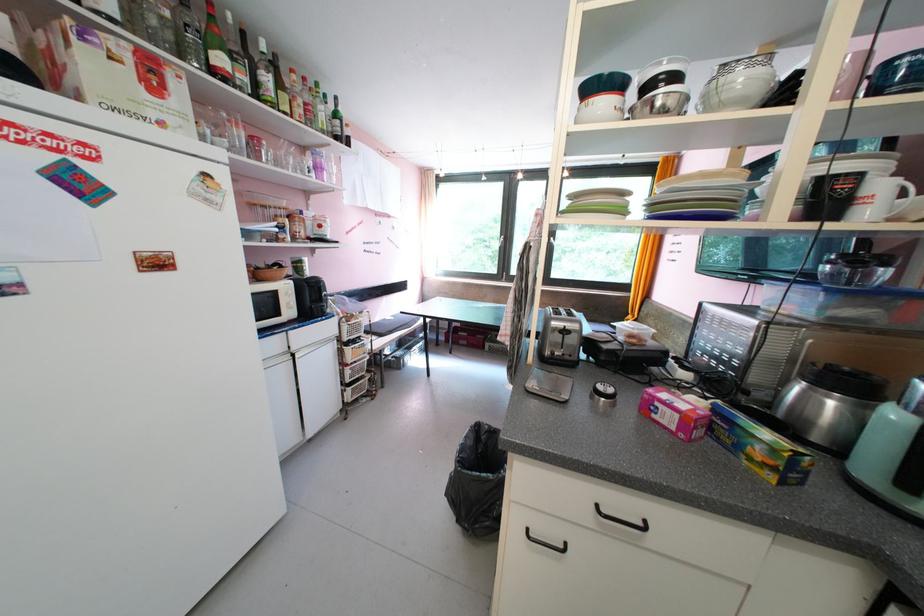
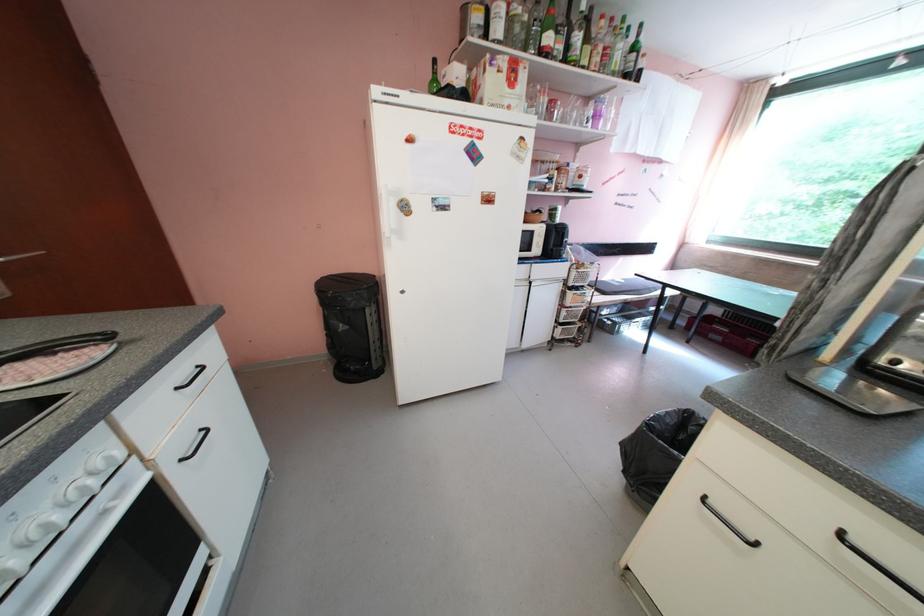
In the second image, find the point that corresponds to the point at 570,548 in the first image.

(759, 541)